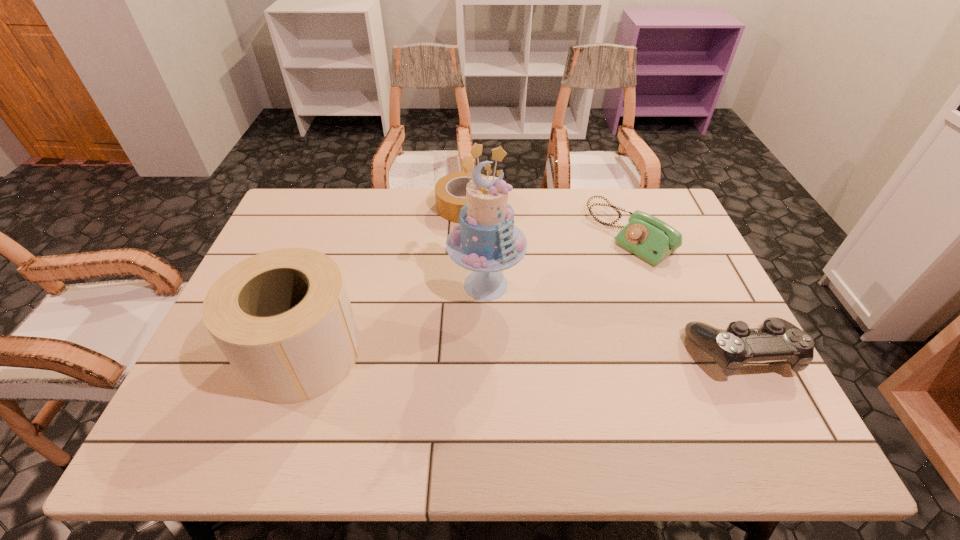
Locate an element on the screen. the leftmost object is located at coordinates (283, 319).

I want to click on the fourth shortest object, so click(283, 319).

Image resolution: width=960 pixels, height=540 pixels. Find the location of `control`. control is located at coordinates click(777, 339).

The height and width of the screenshot is (540, 960). In order to click on the tallest object in this screenshot , I will do `click(486, 241)`.

Find the location of a particular element. telephone is located at coordinates (648, 237).

This screenshot has width=960, height=540. What are the coordinates of `duct tape` in the screenshot? It's located at (448, 189).

The image size is (960, 540). What are the coordinates of `vacant region located 0.250m on the right of the fourth shortest object` in the screenshot? It's located at (465, 352).

Locate an element on the screen. Image resolution: width=960 pixels, height=540 pixels. free spot located on the back of the control is located at coordinates (693, 258).

Identify the location of free location located with a ladder on the side of the tallest object. [498, 354].

At what (x,y) coordinates should I click in order to perform the action: click on vacant region located with a ladder on the side of the tallest object. Please return your answer as a coordinate pair (x, y). This screenshot has height=540, width=960. Looking at the image, I should click on click(503, 383).